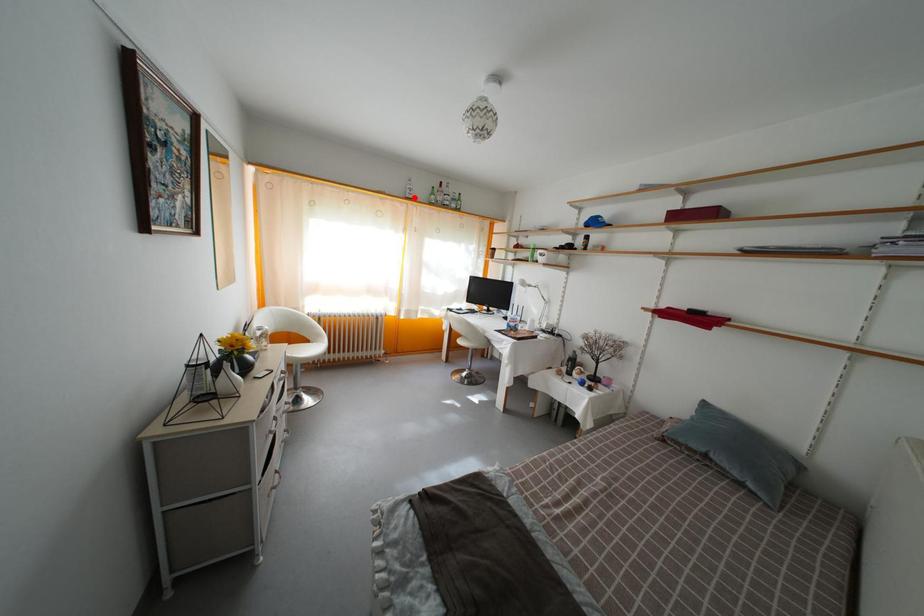
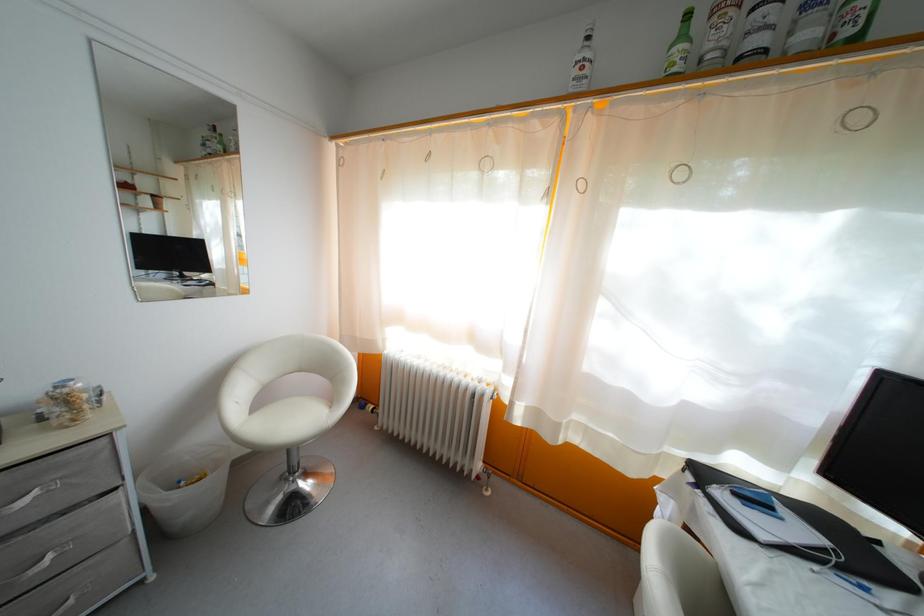
Locate, in the second image, the point that corresponds to the highlighted location in the first image.

(581, 79)